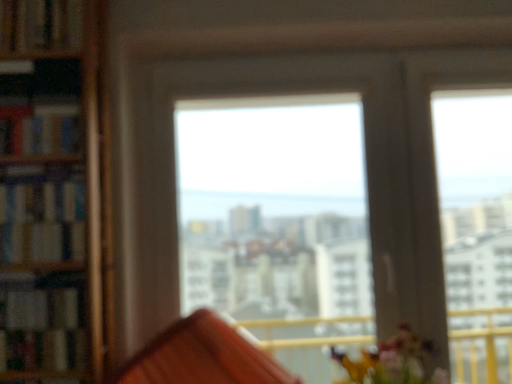
Question: Does point (0, 13) appear closer or farther from the camera than point (23, 127)?

Choices:
 (A) farther
 (B) closer

Answer: (A)

Question: Considering the positions of hardcover book at upper left, the 1th book viewed from the top, and hardcover book at left, which is the second book from top to bottom, in the image, is hardcover book at upper left, the 1th book viewed from the top, wider or thinner than hardcover book at left, which is the second book from top to bottom,?

Choices:
 (A) wide
 (B) thin

Answer: (B)

Question: Estimate the real-world distances between objects in this image. Which object is farther from the hardcover book at left, which is the second book from top to bottom?

Choices:
 (A) hardcover book at upper left, the 1th book viewed from the top
 (B) hardcover book at left, positioned as the 3th book in top-to-bottom order
 (C) transparent glass window at center
 (D) wooden bookshelf at left, which is the 4th book in top-to-bottom order

Answer: (C)

Question: Which is nearer to the hardcover book at left, which is the second book from top to bottom?

Choices:
 (A) hardcover book at upper left, marked as the fourth book in a bottom-to-top arrangement
 (B) transparent glass window at center
 (C) hardcover book at left, positioned as the 2th book in bottom-to-top order
 (D) wooden bookshelf at left, the first book in the bottom-to-top sequence

Answer: (C)